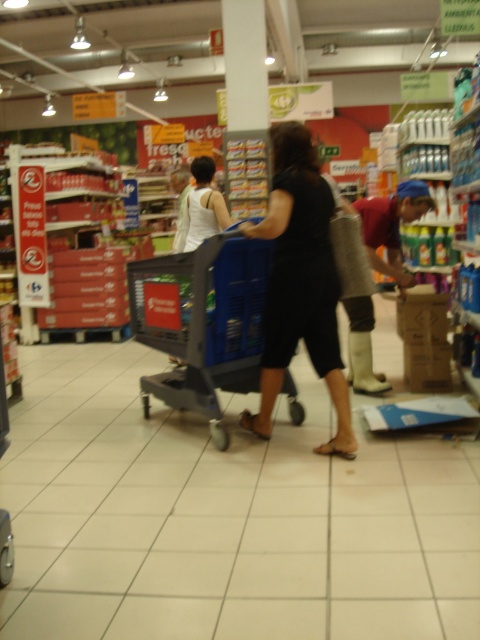
Does white rubber boots at lower center lie in front of white tank top at center?

Yes, it is.

Does white rubber boots at lower center have a smaller size compared to white tank top at center?

Indeed, white rubber boots at lower center has a smaller size compared to white tank top at center.

Does point (385, 225) come closer to viewer compared to point (204, 186)?

Yes, it is in front of point (204, 186).

This screenshot has width=480, height=640. Identify the location of white rubber boots at lower center. (392, 225).

Does black matte dress at center have a larger size compared to white tank top at center?

Indeed, black matte dress at center has a larger size compared to white tank top at center.

Between point (324, 198) and point (202, 170), which one is positioned behind?

The point (202, 170) is behind.

This screenshot has height=640, width=480. What are the coordinates of `black matte dress at center` in the screenshot? It's located at tap(300, 282).

Describe the element at coordinates (300, 282) in the screenshot. The height and width of the screenshot is (640, 480). I see `black matte dress at center` at that location.

Consider the image. Is black matte dress at center smaller than white rubber boots at lower center?

Actually, black matte dress at center might be larger than white rubber boots at lower center.

Is point (301, 232) positioned behind point (376, 198)?

No, it is not.

Locate an element on the screen. The height and width of the screenshot is (640, 480). black matte dress at center is located at coordinates (300, 282).